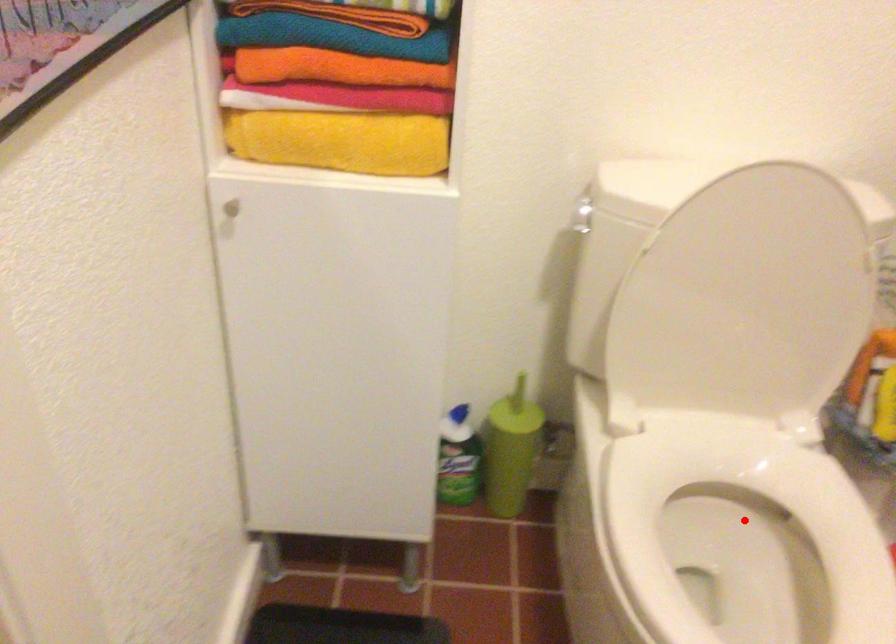
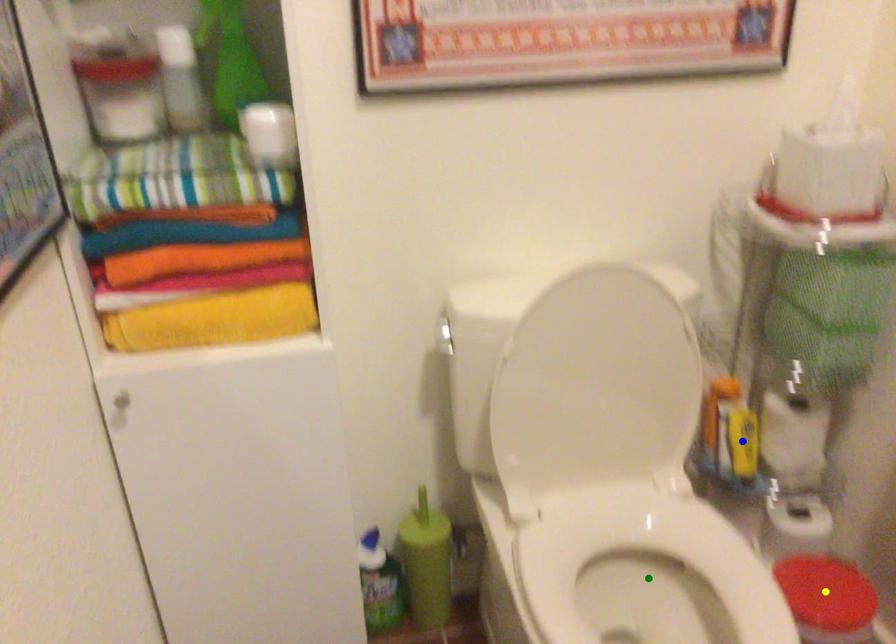
Question: I am providing you with two images of the same scene from different viewpoints. A red point is marked on the first image. You are given multiple points on the second image. Can you choose the point in image 2 that corresponds to the point in image 1?

Choices:
 (A) blue point
 (B) yellow point
 (C) green point

Answer: (C)